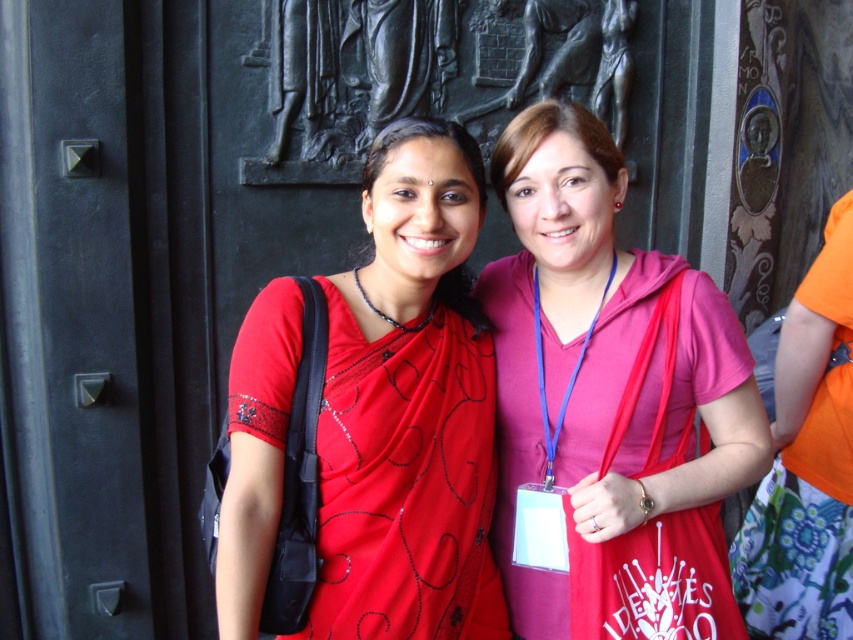
Based on the photo, which of these two, pink fabric at center or matte red sari at center, stands taller?

Standing taller between the two is pink fabric at center.

This screenshot has height=640, width=853. What do you see at coordinates (610, 401) in the screenshot?
I see `pink fabric at center` at bounding box center [610, 401].

Is point (601, 358) less distant than point (418, 284)?

Yes, point (601, 358) is in front of point (418, 284).

You are a GUI agent. You are given a task and a screenshot of the screen. Output one action in this format:
    pyautogui.click(x=<x>, y=<y>)
    Task: Click on the pink fabric at center
    The height and width of the screenshot is (640, 853).
    Given the screenshot: What is the action you would take?
    click(x=610, y=401)

Can you confirm if pink fabric at center is thinner than black metal door at center?

No.

Is pink fabric at center taller than black metal door at center?

No, pink fabric at center is not taller than black metal door at center.

This screenshot has width=853, height=640. Describe the element at coordinates (610, 401) in the screenshot. I see `pink fabric at center` at that location.

Locate an element on the screen. This screenshot has height=640, width=853. pink fabric at center is located at coordinates (610, 401).

Who is more forward, (279,298) or (682,3)?

Point (279,298) is more forward.

Which of these two, matte red sari at center or black metal door at center, stands shorter?

Standing shorter between the two is matte red sari at center.

Identify the location of matte red sari at center. (x=408, y=406).